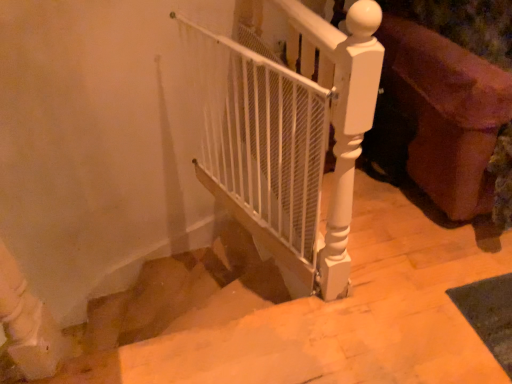
Question: In terms of height, does smooth beige stairs at center look taller or shorter compared to velvet purple sofa at right?

Choices:
 (A) tall
 (B) short

Answer: (B)

Question: From a real-world perspective, is smooth beige stairs at center above or below velvet purple sofa at right?

Choices:
 (A) above
 (B) below

Answer: (B)

Question: Which of these objects is positioned farthest from the velvet purple sofa at right?

Choices:
 (A) smooth beige stairs at center
 (B) smooth beige stairs at center
 (C) white mesh gate at center

Answer: (A)

Question: Which object is positioned farthest from the velvet purple sofa at right?

Choices:
 (A) white mesh gate at center
 (B) smooth beige stairs at center
 (C) smooth beige stairs at center

Answer: (C)